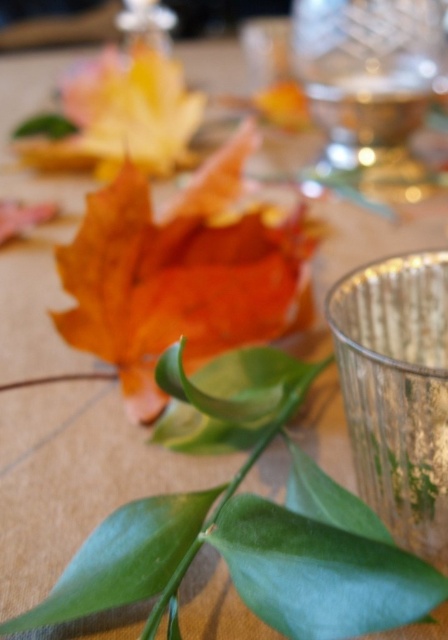
Between orange matte leaf at center and clear glass wine glass at upper right, which one appears on the left side from the viewer's perspective?

From the viewer's perspective, orange matte leaf at center appears more on the left side.

I want to click on orange matte leaf at center, so click(x=181, y=273).

Who is more forward, (x=130, y=397) or (x=383, y=6)?

Point (x=130, y=397)

The width and height of the screenshot is (448, 640). Identify the location of orange matte leaf at center. (181, 273).